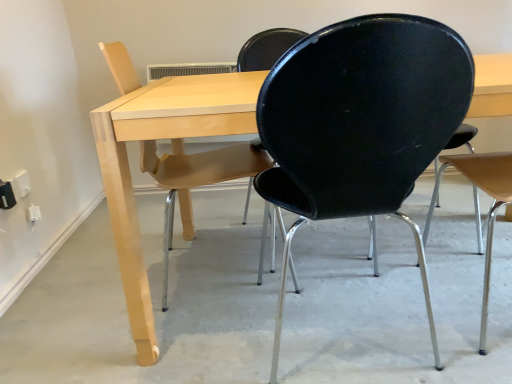
What is the approximate width of matte wood chair at left, the 3th chair positioned from the right?

matte wood chair at left, the 3th chair positioned from the right, is 16.52 inches wide.

What do you see at coordinates (152, 302) in the screenshot? I see `smooth concrete floor at center` at bounding box center [152, 302].

Locate an element on the screen. light wood table at center is located at coordinates (173, 152).

Where is `black plastic chair at center, arranged as the second chair when viewed from the right`? The height and width of the screenshot is (384, 512). black plastic chair at center, arranged as the second chair when viewed from the right is located at coordinates (360, 122).

In order to face black matte chair at right, positioned as the first chair in right-to-left order, should I rotate leftwards or rightwards?

Turn right approximately 33.354 degrees to face it.

Where is `matte wood chair at left, the 3th chair positioned from the right`? The image size is (512, 384). matte wood chair at left, the 3th chair positioned from the right is located at coordinates (198, 178).

The width and height of the screenshot is (512, 384). What are the coordinates of `table to the right of black plastic chair at center, which ranks as the second chair in left-to-right order` in the screenshot? It's located at (173, 152).

Which is less distant, (x=266, y=196) or (x=138, y=241)?

Point (x=266, y=196) is farther from the camera than point (x=138, y=241).

Could you measure the distance between black plastic chair at center, which ranks as the second chair in left-to-right order, and light wood table at center?

black plastic chair at center, which ranks as the second chair in left-to-right order, and light wood table at center are 12.36 inches apart from each other.

Is smooth concrete floor at center bigger than light wood table at center?

No, smooth concrete floor at center is not bigger than light wood table at center.

Is smooth concrete floor at center placed right next to light wood table at center?

No, smooth concrete floor at center is not with light wood table at center.

Who is taller, smooth concrete floor at center or light wood table at center?

light wood table at center.

Looking at their sizes, would you say smooth concrete floor at center is wider or thinner than light wood table at center?

In the image, smooth concrete floor at center appears to be wider than light wood table at center.

From a real-world perspective, is black plastic chair at center, arranged as the second chair when viewed from the right, physically above smooth concrete floor at center?

Indeed, from a real-world perspective, black plastic chair at center, arranged as the second chair when viewed from the right, stands above smooth concrete floor at center.

Can you confirm if black plastic chair at center, arranged as the second chair when viewed from the right, is positioned to the right of smooth concrete floor at center?

Yes.

Could you tell me if black plastic chair at center, arranged as the second chair when viewed from the right, is turned towards smooth concrete floor at center?

Yes, black plastic chair at center, arranged as the second chair when viewed from the right, faces towards smooth concrete floor at center.

How far apart are light wood table at center and matte wood chair at left, the 3th chair positioned from the right?

light wood table at center is 11.95 inches away from matte wood chair at left, the 3th chair positioned from the right.

From a real-world perspective, is light wood table at center located higher than matte wood chair at left, the 3th chair positioned from the right?

Incorrect, from a real-world perspective, light wood table at center is lower than matte wood chair at left, the 3th chair positioned from the right.

Looking at this image, are light wood table at center and matte wood chair at left, which appears as the first chair when viewed from the left, far apart?

No, light wood table at center is not far from matte wood chair at left, which appears as the first chair when viewed from the left.

Considering the sizes of objects light wood table at center and matte wood chair at left, which appears as the first chair when viewed from the left, in the image provided, who is thinner, light wood table at center or matte wood chair at left, which appears as the first chair when viewed from the left,?

matte wood chair at left, which appears as the first chair when viewed from the left.

Do you think black matte chair at right, acting as the 3th chair starting from the left, is within white plastic electric outlet at lower left, or outside of it?

black matte chair at right, acting as the 3th chair starting from the left, cannot be found inside white plastic electric outlet at lower left.

From a real-world perspective, which is physically above, black matte chair at right, acting as the 3th chair starting from the left, or white plastic electric outlet at lower left?

black matte chair at right, acting as the 3th chair starting from the left, is physically above.

Is point (490, 244) closer to viewer compared to point (26, 181)?

Yes.

Considering the relative positions of white plastic electric outlet at lower left and black plastic chair at center, which ranks as the second chair in left-to-right order, in the image provided, is white plastic electric outlet at lower left to the right of black plastic chair at center, which ranks as the second chair in left-to-right order, from the viewer's perspective?

No, white plastic electric outlet at lower left is not to the right of black plastic chair at center, which ranks as the second chair in left-to-right order.

From a real-world perspective, starting from the white plastic electric outlet at lower left, which chair is the 3rd one vertically above it? Please provide its 2D coordinates.

[(360, 122)]

Would you consider white plastic electric outlet at lower left to be distant from black plastic chair at center, arranged as the second chair when viewed from the right?

Absolutely, white plastic electric outlet at lower left is distant from black plastic chair at center, arranged as the second chair when viewed from the right.

From the image's perspective, which one is positioned lower, white plastic electric outlet at lower left or black matte chair at right, positioned as the first chair in right-to-left order?

white plastic electric outlet at lower left appears lower in the image.

Is white plastic electric outlet at lower left further to camera compared to black matte chair at right, acting as the 3th chair starting from the left?

Yes, white plastic electric outlet at lower left is behind black matte chair at right, acting as the 3th chair starting from the left.

Considering the sizes of white plastic electric outlet at lower left and black matte chair at right, acting as the 3th chair starting from the left, in the image, is white plastic electric outlet at lower left taller or shorter than black matte chair at right, acting as the 3th chair starting from the left,?

In the image, white plastic electric outlet at lower left appears to be shorter than black matte chair at right, acting as the 3th chair starting from the left.

Is white plastic electric outlet at lower left located outside black matte chair at right, positioned as the first chair in right-to-left order?

Yes, white plastic electric outlet at lower left is not within black matte chair at right, positioned as the first chair in right-to-left order.

Identify the location of table directly beneath the black plastic chair at center, which ranks as the second chair in left-to-right order (from a real-world perspective). Image resolution: width=512 pixels, height=384 pixels. (173, 152).

You are a GUI agent. You are given a task and a screenshot of the screen. Output one action in this format:
    pyautogui.click(x=<x>, y=<y>)
    Task: Click on the concrete on the left of light wood table at center
    
    Given the screenshot: What is the action you would take?
    pyautogui.click(x=152, y=302)

Considering their positions, is black plastic chair at center, arranged as the second chair when viewed from the right, positioned further to smooth concrete floor at center than light wood table at center?

light wood table at center.

Looking at the image, which one is located further to smooth concrete floor at center, black matte chair at right, acting as the 3th chair starting from the left, or matte wood chair at left, the 3th chair positioned from the right?

black matte chair at right, acting as the 3th chair starting from the left, is further to smooth concrete floor at center.

From the image, which object appears to be farther from light wood table at center, black plastic chair at center, arranged as the second chair when viewed from the right, or smooth concrete floor at center?

Among the two, smooth concrete floor at center is located further to light wood table at center.

Looking at this image, based on their spatial positions, is black matte chair at right, acting as the 3th chair starting from the left, or smooth concrete floor at center further from light wood table at center?

black matte chair at right, acting as the 3th chair starting from the left, lies further to light wood table at center than the other object.

Looking at the image, which one is located further to light wood table at center, white plastic electric outlet at lower left or black plastic chair at center, which ranks as the second chair in left-to-right order?

Among the two, white plastic electric outlet at lower left is located further to light wood table at center.

Which object lies further to the anchor point black matte chair at right, acting as the 3th chair starting from the left, white plastic electric outlet at lower left or smooth concrete floor at center?

white plastic electric outlet at lower left.

Which object lies further to the anchor point smooth concrete floor at center, black matte chair at right, positioned as the first chair in right-to-left order, or white plastic electric outlet at lower left?

Among the two, white plastic electric outlet at lower left is located further to smooth concrete floor at center.

Looking at the image, which one is located closer to white plastic electric outlet at lower left, black matte chair at right, acting as the 3th chair starting from the left, or smooth concrete floor at center?

smooth concrete floor at center is closer to white plastic electric outlet at lower left.

This screenshot has width=512, height=384. In order to click on chair located between matte wood chair at left, which appears as the first chair when viewed from the left, and black matte chair at right, acting as the 3th chair starting from the left, in the left-right direction in this screenshot , I will do `click(360, 122)`.

You are a GUI agent. You are given a task and a screenshot of the screen. Output one action in this format:
    pyautogui.click(x=<x>, y=<y>)
    Task: Click on the chair located between smooth concrete floor at center and black matte chair at right, positioned as the first chair in right-to-left order, in the left-right direction
    
    Given the screenshot: What is the action you would take?
    pyautogui.click(x=360, y=122)

The height and width of the screenshot is (384, 512). Identify the location of concrete situated between matte wood chair at left, the 3th chair positioned from the right, and black matte chair at right, acting as the 3th chair starting from the left, from left to right. (152, 302).

Locate an element on the screen. The height and width of the screenshot is (384, 512). table situated between smooth concrete floor at center and black matte chair at right, positioned as the first chair in right-to-left order, from left to right is located at coordinates (173, 152).